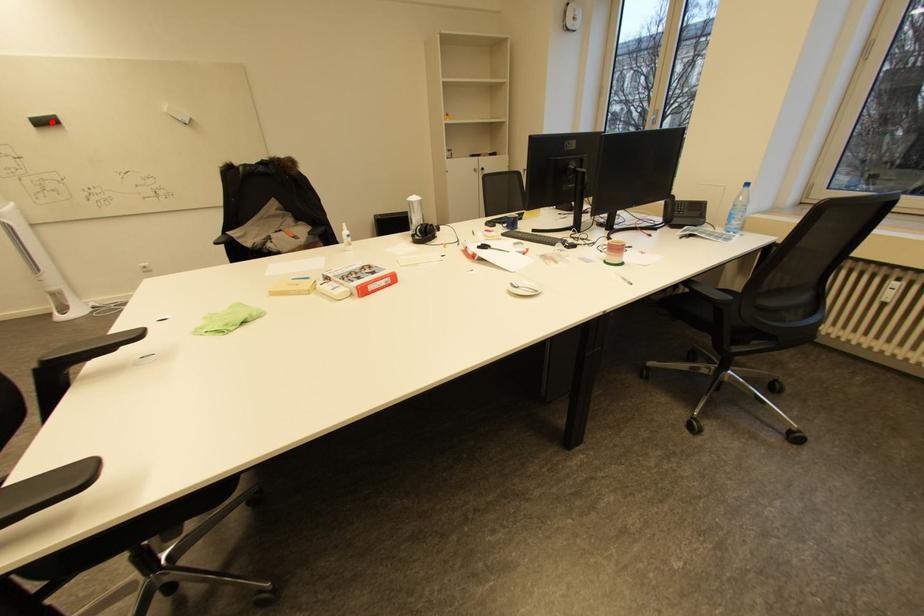
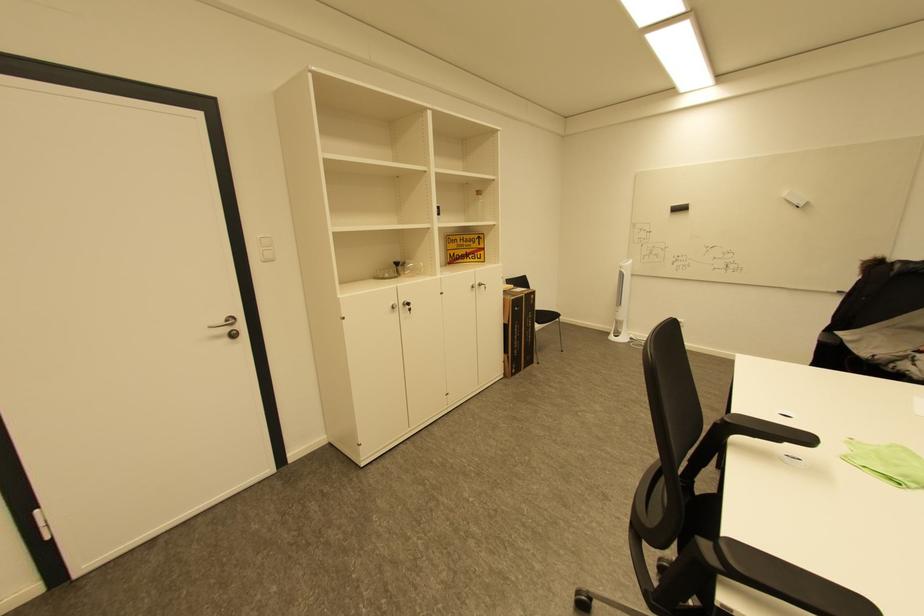
Where in the second image is the point corresponding to the highlighted location from the first image?

(686, 209)